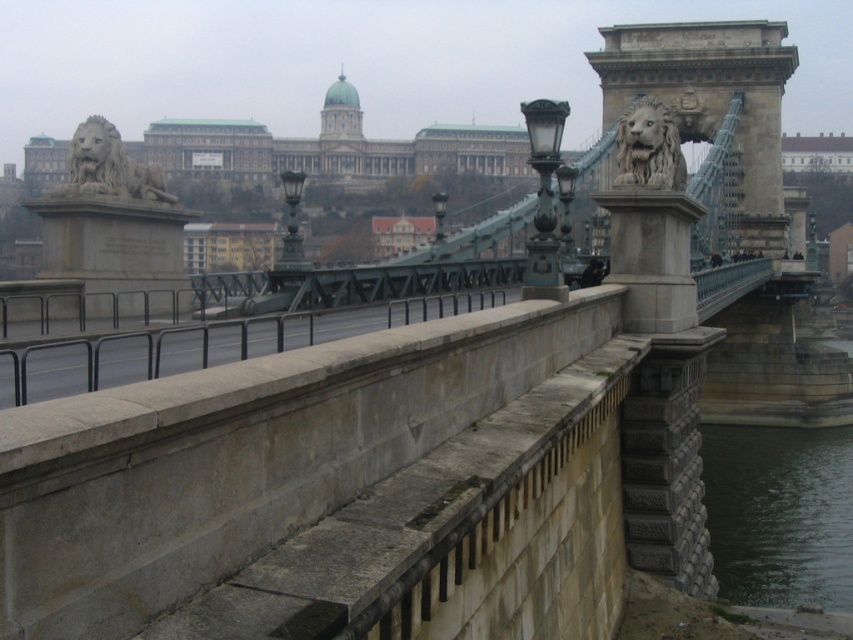
You are standing on the Chain Bridge in Budapest and want to take a photo of the dark green water at lower right. Where should you position yourself to capture it in the frame?

To capture the dark green water at lower right in your photo, position yourself at point (780, 513).

You are standing on the Chain Bridge in Budapest and want to take a photo of the gray metal rail at center. According to the coordinates provided, where should you position your camera to capture the rail in the frame?

The gray metal rail at center is located at coordinates point (204, 346), so you should position your camera to aim at that specific coordinate to capture the rail in the frame.

You are standing on the Chain Bridge in Budapest and want to take a photo of the gray metal rail at center and the dark green water at lower right. Which object should you focus on first if you want both to be in sharp focus?

You should focus on the gray metal rail at center first because it is behind the dark green water at lower right, so focusing on the farther object will help both be in focus.